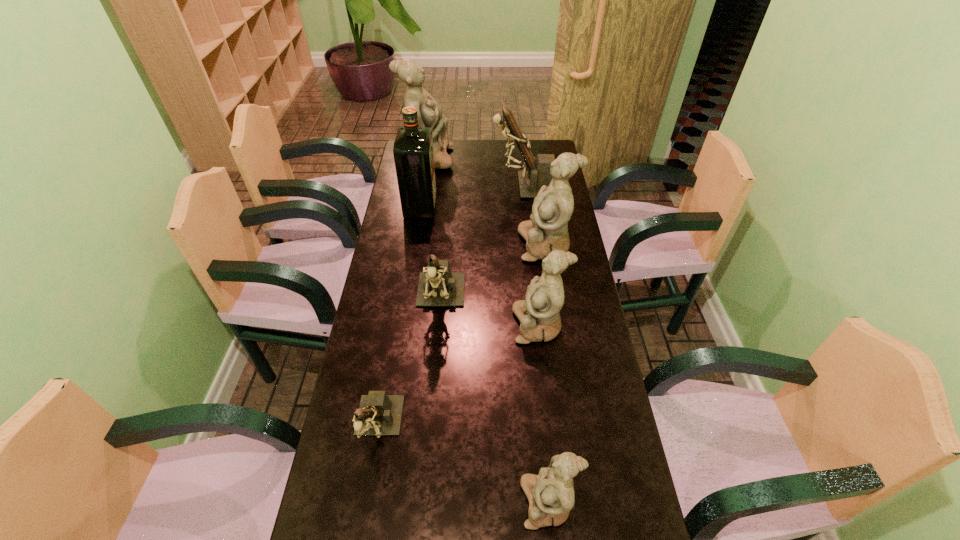
This screenshot has height=540, width=960. I want to click on the farthest object, so click(x=429, y=112).

Image resolution: width=960 pixels, height=540 pixels. Identify the location of the biggest white figurine. click(x=429, y=112).

Identify the location of liquor. Image resolution: width=960 pixels, height=540 pixels. (413, 152).

At what (x,y) coordinates should I click in order to perform the action: click on the fifth nearest figurine. Please return your answer as a coordinate pair (x, y). Looking at the image, I should click on (547, 230).

This screenshot has height=540, width=960. Identify the location of the second biggest white figurine. (547, 230).

Locate an element on the screen. This screenshot has width=960, height=540. the biggest brown figurine is located at coordinates (530, 182).

The width and height of the screenshot is (960, 540). I want to click on the second farthest figurine, so pyautogui.click(x=530, y=182).

Locate an element on the screen. The image size is (960, 540). the second farthest brown figurine is located at coordinates (438, 287).

Image resolution: width=960 pixels, height=540 pixels. Identify the location of the second smallest white figurine. (539, 316).

Where is `the smallest white figurine`? the smallest white figurine is located at coordinates (551, 496).